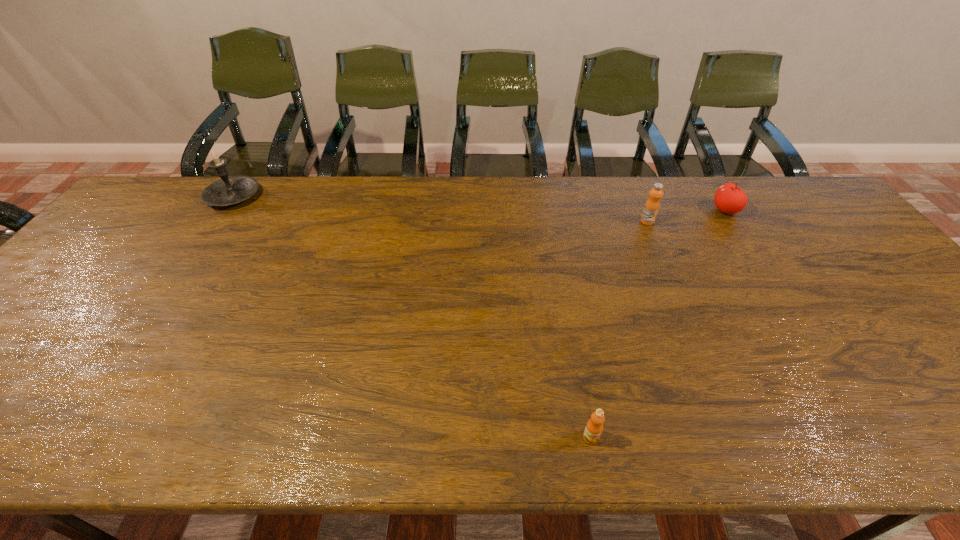
Find the location of a particular element. The image size is (960, 540). candle that is at the far edge is located at coordinates (230, 190).

Image resolution: width=960 pixels, height=540 pixels. I want to click on orange juice that is at the far edge, so click(652, 205).

The width and height of the screenshot is (960, 540). I want to click on apple that is positioned at the far edge, so click(x=730, y=199).

The image size is (960, 540). Find the location of `object that is at the near edge`. object that is at the near edge is located at coordinates (594, 427).

Locate an element on the screen. The width and height of the screenshot is (960, 540). vacant space at the far edge of the desktop is located at coordinates pyautogui.click(x=273, y=190).

The height and width of the screenshot is (540, 960). In the image, there is a desktop. Identify the location of free region at the near edge. (303, 426).

Where is `free region at the left edge of the desktop`? free region at the left edge of the desktop is located at coordinates (6, 366).

Locate an element on the screen. vacant space at the right edge of the desktop is located at coordinates (841, 228).

The width and height of the screenshot is (960, 540). I want to click on vacant region between the tallest object and the farther orange juice, so click(441, 209).

In order to click on free area in between the leftmost object and the rightmost object in this screenshot , I will do `click(479, 204)`.